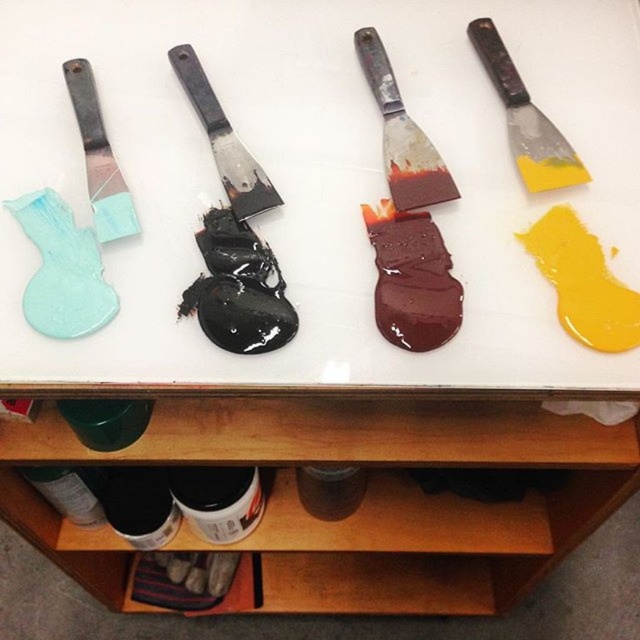
You are an artist who needs to locate the satin red spatula at center on your white table. Based on the coordinates provided, where exactly should you look on the table to find it?

The satin red spatula at center is located at coordinates point (401, 134) on the table.